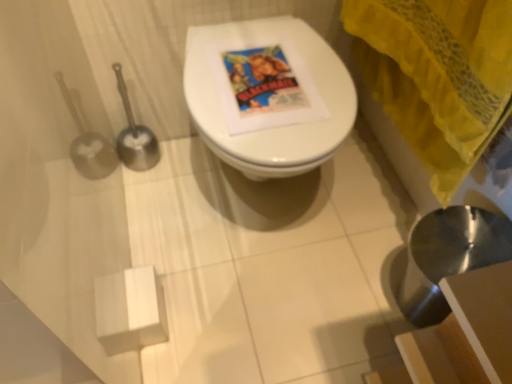
The width and height of the screenshot is (512, 384). Find the location of `white glossy toilet at center`. white glossy toilet at center is located at coordinates (275, 127).

Describe the element at coordinates (437, 75) in the screenshot. I see `yellow fabric curtain at upper right` at that location.

Where is `white glossy toilet at center`? white glossy toilet at center is located at coordinates (275, 127).

In the scene shown: From the image's perspective, is metallic silver sink at lower right above or below yellow fabric curtain at upper right?

metallic silver sink at lower right is situated lower than yellow fabric curtain at upper right in the image.

Would you say metallic silver sink at lower right is a long distance from yellow fabric curtain at upper right?

No, metallic silver sink at lower right is in close proximity to yellow fabric curtain at upper right.

This screenshot has height=384, width=512. I want to click on curtain above the metallic silver sink at lower right (from a real-world perspective), so click(x=437, y=75).

Is metallic silver sink at lower right thinner than yellow fabric curtain at upper right?

Incorrect, the width of metallic silver sink at lower right is not less than that of yellow fabric curtain at upper right.

From a real-world perspective, between yellow fabric curtain at upper right and white glossy toilet at center, who is vertically higher?

yellow fabric curtain at upper right.

Is yellow fabric curtain at upper right closer to camera compared to white glossy toilet at center?

Yes, yellow fabric curtain at upper right is closer to the camera.

What's the angular difference between yellow fabric curtain at upper right and white glossy toilet at center's facing directions?

87.1 degrees separate the facing orientations of yellow fabric curtain at upper right and white glossy toilet at center.

Could you tell me if yellow fabric curtain at upper right is turned towards white glossy toilet at center?

Yes.

Could you tell me if yellow fabric curtain at upper right is turned towards metallic silver sink at lower right?

No, yellow fabric curtain at upper right is not turned towards metallic silver sink at lower right.

In terms of height, does yellow fabric curtain at upper right look taller or shorter compared to metallic silver sink at lower right?

In the image, yellow fabric curtain at upper right appears to be shorter than metallic silver sink at lower right.

From a real-world perspective, which object rests below the other?

metallic silver sink at lower right.

From the image's perspective, who appears lower, yellow fabric curtain at upper right or metallic silver sink at lower right?

metallic silver sink at lower right, from the image's perspective.

Considering the relative sizes of white glossy toilet at center and yellow fabric curtain at upper right in the image provided, is white glossy toilet at center shorter than yellow fabric curtain at upper right?

Correct, white glossy toilet at center is not as tall as yellow fabric curtain at upper right.

Is white glossy toilet at center positioned far away from yellow fabric curtain at upper right?

No.

Looking at their sizes, would you say white glossy toilet at center is wider or thinner than yellow fabric curtain at upper right?

white glossy toilet at center is wider than yellow fabric curtain at upper right.

How many degrees apart are the facing directions of white glossy toilet at center and yellow fabric curtain at upper right?

There is a 87.1-degree angle between the facing directions of white glossy toilet at center and yellow fabric curtain at upper right.

From the image's perspective, is white glossy toilet at center located above or below metallic silver sink at lower right?

white glossy toilet at center is situated higher than metallic silver sink at lower right in the image.

Can you tell me how much white glossy toilet at center and metallic silver sink at lower right differ in facing direction?

89.1 degrees separate the facing orientations of white glossy toilet at center and metallic silver sink at lower right.

From a real-world perspective, which is physically above, white glossy toilet at center or metallic silver sink at lower right?

metallic silver sink at lower right.

Considering the points (227, 155) and (436, 288), which point is behind, point (227, 155) or point (436, 288)?

Point (436, 288)

What's the angular difference between metallic silver sink at lower right and white glossy toilet at center's facing directions?

89.1 degrees.

Is metallic silver sink at lower right in front of white glossy toilet at center?

Yes.

Can you confirm if metallic silver sink at lower right is shorter than white glossy toilet at center?

Incorrect, the height of metallic silver sink at lower right does not fall short of that of white glossy toilet at center.

Which is correct: metallic silver sink at lower right is inside white glossy toilet at center, or outside of it?

metallic silver sink at lower right lies outside white glossy toilet at center.

Locate an element on the screen. The height and width of the screenshot is (384, 512). sink below the yellow fabric curtain at upper right (from a real-world perspective) is located at coordinates (449, 256).

Where is `curtain that is on the right side of white glossy toilet at center`? This screenshot has width=512, height=384. curtain that is on the right side of white glossy toilet at center is located at coordinates (437, 75).

Estimate the real-world distances between objects in this image. Which object is closer to yellow fabric curtain at upper right, white glossy toilet at center or metallic silver sink at lower right?

white glossy toilet at center is positioned closer to the anchor yellow fabric curtain at upper right.

Which object lies nearer to the anchor point metallic silver sink at lower right, white glossy toilet at center or yellow fabric curtain at upper right?

Among the two, yellow fabric curtain at upper right is located nearer to metallic silver sink at lower right.

Considering their positions, is metallic silver sink at lower right positioned closer to white glossy toilet at center than yellow fabric curtain at upper right?

yellow fabric curtain at upper right.

From the image, which object appears to be farther from yellow fabric curtain at upper right, metallic silver sink at lower right or white glossy toilet at center?

Based on the image, metallic silver sink at lower right appears to be further to yellow fabric curtain at upper right.

From the image, which object appears to be nearer to white glossy toilet at center, yellow fabric curtain at upper right or metallic silver sink at lower right?

Based on the image, yellow fabric curtain at upper right appears to be nearer to white glossy toilet at center.

Which object lies further to the anchor point metallic silver sink at lower right, yellow fabric curtain at upper right or white glossy toilet at center?

white glossy toilet at center is further to metallic silver sink at lower right.

Locate an element on the screen. This screenshot has height=384, width=512. toilet between yellow fabric curtain at upper right and metallic silver sink at lower right in the up-down direction is located at coordinates (275, 127).